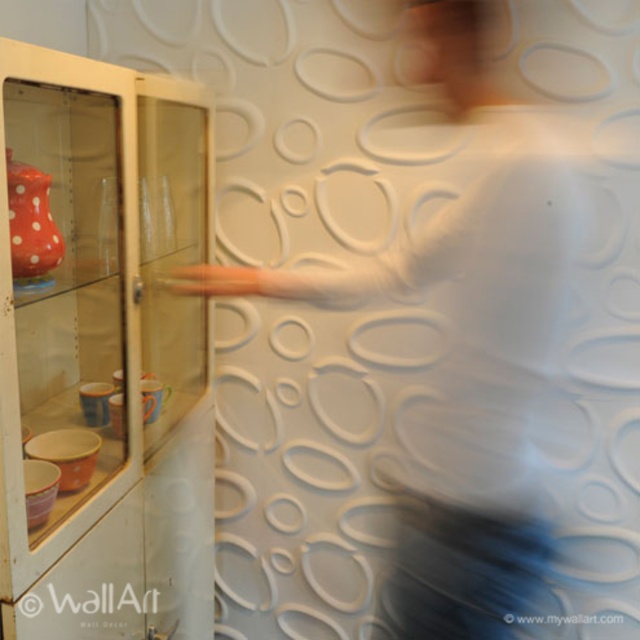
Question: Is transparent glass cabinet at left thinner than white matte shirt at center?

Choices:
 (A) yes
 (B) no

Answer: (A)

Question: Does transparent glass cabinet at left lie behind white matte shirt at center?

Choices:
 (A) yes
 (B) no

Answer: (B)

Question: Is transparent glass cabinet at left wider than white matte shirt at center?

Choices:
 (A) no
 (B) yes

Answer: (A)

Question: Which point is closer to the camera?

Choices:
 (A) coord(188,275)
 (B) coord(120,189)

Answer: (B)

Question: Among these points, which one is nearest to the camera?

Choices:
 (A) (333, 307)
 (B) (170, 170)

Answer: (A)